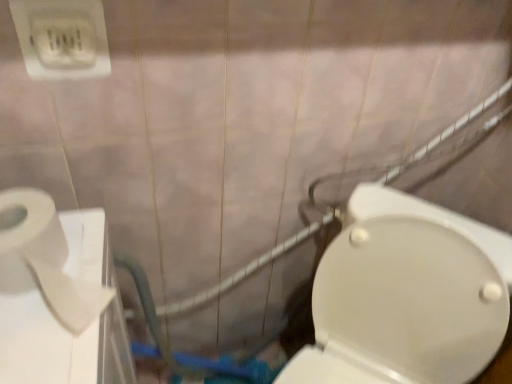
Locate an element on the screen. white plastic outlet at upper left is located at coordinates (62, 38).

Where is `white glossy toilet at center right`? This screenshot has width=512, height=384. white glossy toilet at center right is located at coordinates (406, 295).

Where is `white matte toilet paper at left`? white matte toilet paper at left is located at coordinates (44, 259).

Consider the image. Is white matte toilet paper at left shorter than white plastic outlet at upper left?

Yes, white matte toilet paper at left is shorter than white plastic outlet at upper left.

What's the angular difference between white matte toilet paper at left and white plastic outlet at upper left's facing directions?

white matte toilet paper at left and white plastic outlet at upper left are facing 5.83 degrees away from each other.

Image resolution: width=512 pixels, height=384 pixels. I want to click on toilet paper on the right of white plastic outlet at upper left, so click(44, 259).

Which of these two, white plastic outlet at upper left or white matte toilet paper at left, is bigger?

With larger size is white matte toilet paper at left.

Is the position of white plastic outlet at upper left more distant than that of white matte toilet paper at left?

That is True.

Considering the relative sizes of white plastic outlet at upper left and white matte toilet paper at left in the image provided, is white plastic outlet at upper left taller than white matte toilet paper at left?

Yes, white plastic outlet at upper left is taller than white matte toilet paper at left.

From a real-world perspective, between white matte toilet paper at left and white glossy toilet at center right, who is vertically lower?

white glossy toilet at center right.

The width and height of the screenshot is (512, 384). Find the location of `toilet lying below the white matte toilet paper at left (from the image's perspective)`. toilet lying below the white matte toilet paper at left (from the image's perspective) is located at coordinates (406, 295).

Is white matte toilet paper at left not near white glossy toilet at center right?

Actually, white matte toilet paper at left and white glossy toilet at center right are a little close together.

From the image's perspective, relative to white glossy toilet at center right, is white matte toilet paper at left above or below?

white matte toilet paper at left is above white glossy toilet at center right.

Looking at the image, does white glossy toilet at center right seem bigger or smaller compared to white plastic outlet at upper left?

Clearly, white glossy toilet at center right is larger in size than white plastic outlet at upper left.

From a real-world perspective, is white glossy toilet at center right below white plastic outlet at upper left?

Indeed, from a real-world perspective, white glossy toilet at center right is positioned beneath white plastic outlet at upper left.

Which is in front, white glossy toilet at center right or white plastic outlet at upper left?

white glossy toilet at center right is closer to the camera.

Are white plastic outlet at upper left and white glossy toilet at center right located far from each other?

No.

Does white plastic outlet at upper left appear on the left side of white glossy toilet at center right?

Yes, white plastic outlet at upper left is to the left of white glossy toilet at center right.

Considering the sizes of objects white plastic outlet at upper left and white glossy toilet at center right in the image provided, who is wider, white plastic outlet at upper left or white glossy toilet at center right?

With larger width is white glossy toilet at center right.

Locate an element on the screen. Image resolution: width=512 pixels, height=384 pixels. toilet on the right of white plastic outlet at upper left is located at coordinates (406, 295).

Is white glossy toilet at center right oriented away from white matte toilet paper at left?

No, white matte toilet paper at left is not at the back of white glossy toilet at center right.

From the image's perspective, which is above, white glossy toilet at center right or white matte toilet paper at left?

From the image's view, white matte toilet paper at left is above.

Considering the relative sizes of white glossy toilet at center right and white matte toilet paper at left in the image provided, is white glossy toilet at center right smaller than white matte toilet paper at left?

No.

Which object is thinner, white glossy toilet at center right or white matte toilet paper at left?

white matte toilet paper at left is thinner.

The height and width of the screenshot is (384, 512). I want to click on electric outlet that is above the white matte toilet paper at left (from a real-world perspective), so click(62, 38).

The image size is (512, 384). I want to click on electric outlet that appears on the left of white matte toilet paper at left, so click(62, 38).

From the image, which object appears to be farther from white plastic outlet at upper left, white glossy toilet at center right or white matte toilet paper at left?

Based on the image, white glossy toilet at center right appears to be further to white plastic outlet at upper left.

Based on their spatial positions, is white matte toilet paper at left or white glossy toilet at center right closer to white plastic outlet at upper left?

Based on the image, white matte toilet paper at left appears to be nearer to white plastic outlet at upper left.

Looking at the image, which one is located closer to white glossy toilet at center right, white plastic outlet at upper left or white matte toilet paper at left?

white matte toilet paper at left is positioned closer to the anchor white glossy toilet at center right.

Which object lies nearer to the anchor point white matte toilet paper at left, white glossy toilet at center right or white plastic outlet at upper left?

Based on the image, white plastic outlet at upper left appears to be nearer to white matte toilet paper at left.

Estimate the real-world distances between objects in this image. Which object is further from white glossy toilet at center right, white matte toilet paper at left or white plastic outlet at upper left?

The object further to white glossy toilet at center right is white plastic outlet at upper left.

When comparing their distances from white matte toilet paper at left, does white plastic outlet at upper left or white glossy toilet at center right seem further?

Based on the image, white glossy toilet at center right appears to be further to white matte toilet paper at left.

Image resolution: width=512 pixels, height=384 pixels. Identify the location of toilet paper that lies between white plastic outlet at upper left and white glossy toilet at center right from top to bottom. (44, 259).